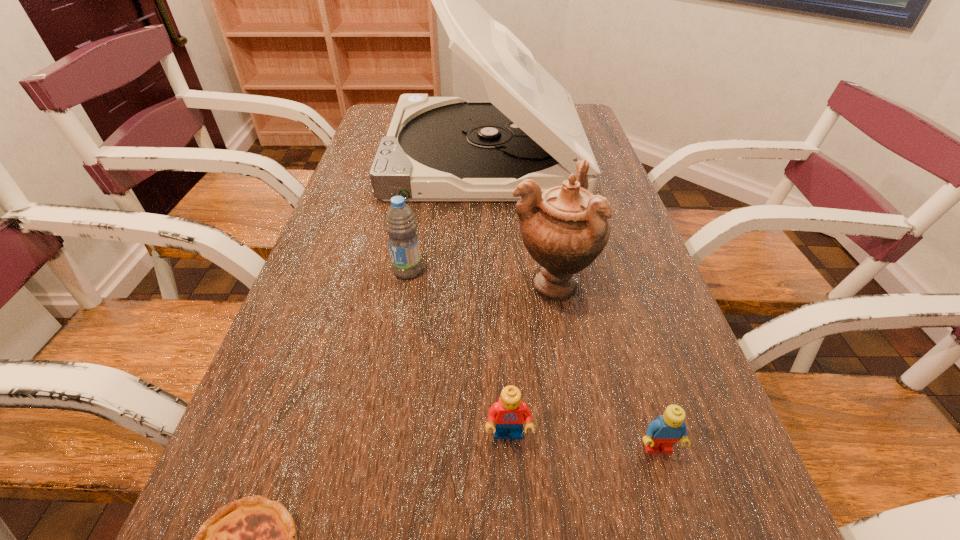
Locate an element on the screen. This screenshot has width=960, height=540. free space at the far right corner of the desktop is located at coordinates (588, 130).

You are a GUI agent. You are given a task and a screenshot of the screen. Output one action in this format:
    pyautogui.click(x=<x>, y=<y>)
    Task: Click on the free space between the left Lego and the fourth shortest object
    
    Given the screenshot: What is the action you would take?
    pyautogui.click(x=458, y=353)

Find the location of a particular element. vacant region between the right Lego and the urn is located at coordinates (605, 366).

This screenshot has width=960, height=540. I want to click on blank region between the right Lego and the left Lego, so click(583, 442).

In order to click on free space between the left Lego and the right Lego in this screenshot , I will do `click(583, 442)`.

The height and width of the screenshot is (540, 960). I want to click on unoccupied area between the second tallest object and the right Lego, so click(x=605, y=366).

Select which object appears as the fourth closest to the shortest object. Please provide its 2D coordinates. Your answer should be formatted as a tuple, i.e. [(x, y)], where the tuple contains the x and y coordinates of a point satisfying the conditions above.

[(662, 433)]

Where is `object that is the closest one to the urn`? object that is the closest one to the urn is located at coordinates (400, 224).

Locate an element on the screen. The height and width of the screenshot is (540, 960). free space that satisfies the following two spatial constraints: 1. on the control panel of the CD player; 2. on the front side of the water bottle is located at coordinates (485, 271).